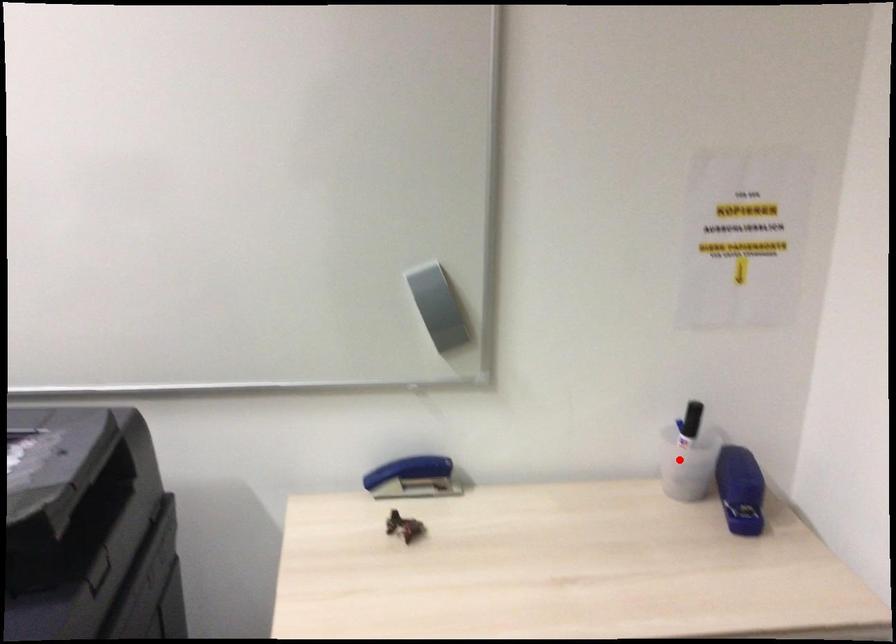
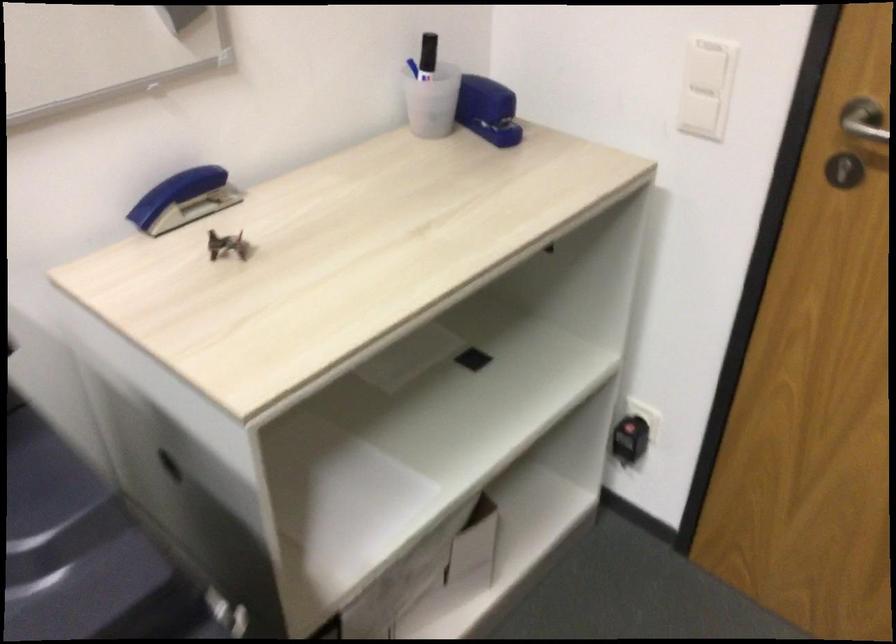
The point at the highlighted location is marked in the first image. Where is the corresponding point in the second image?

(428, 102)